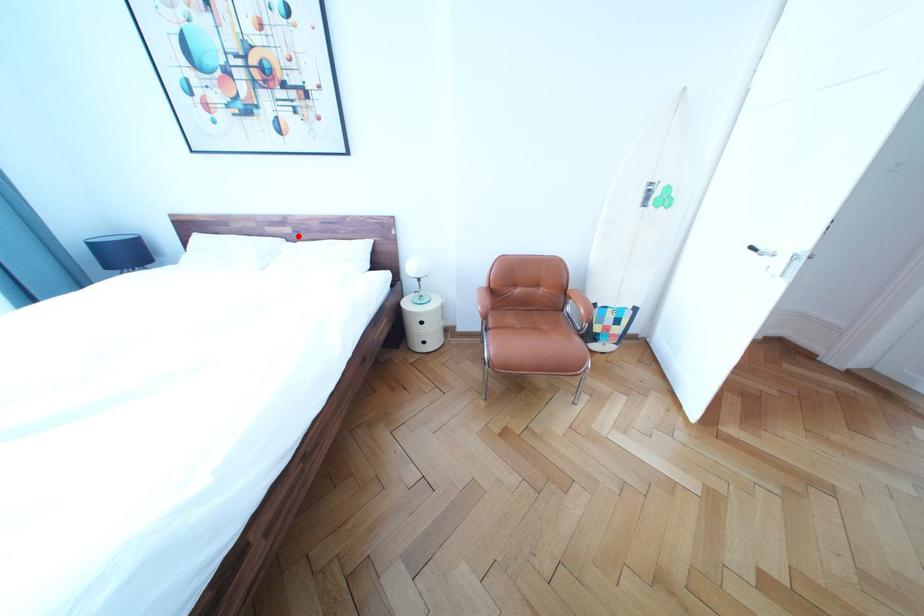
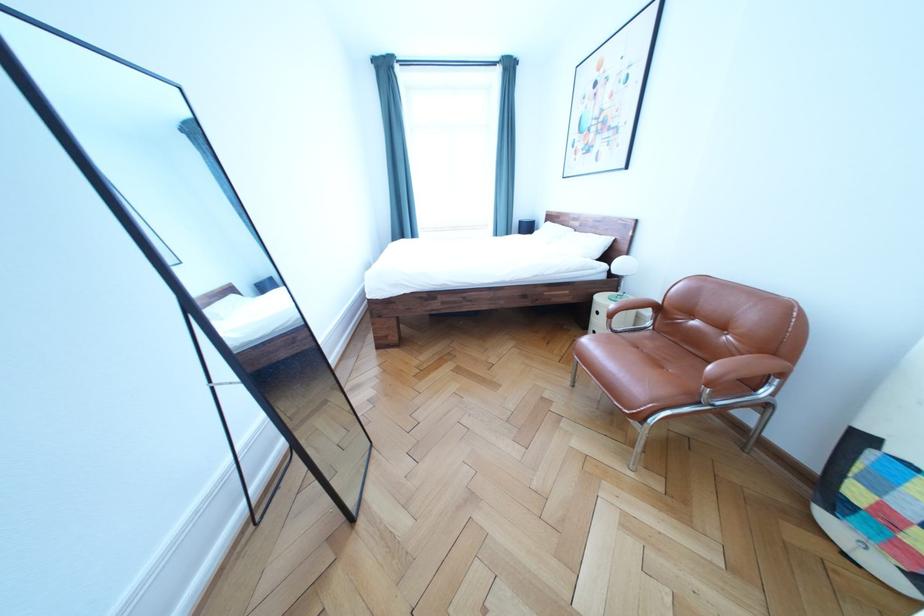
Where in the second image is the point corresponding to the highlighted location from the first image?

(588, 230)